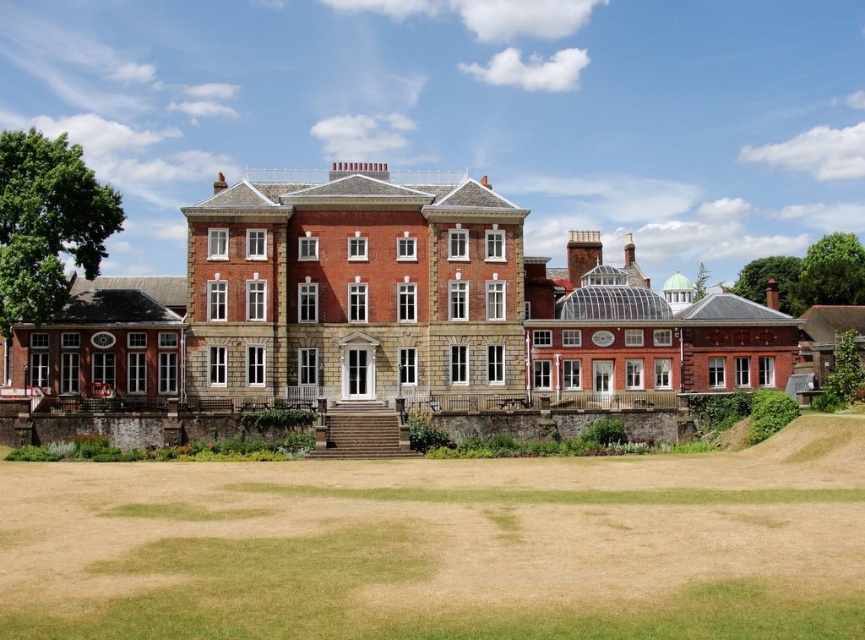
You are a landscape architect planning to install a small garden between the brown grass at lower center and the brick stone mansion at center. Given their sizes, which area would be more suitable for placing a decorative fountain?

The brick stone mansion at center has a larger size than the brown grass at lower center, so the fountain would be more appropriately placed near the brick stone mansion at center to ensure visibility and space.